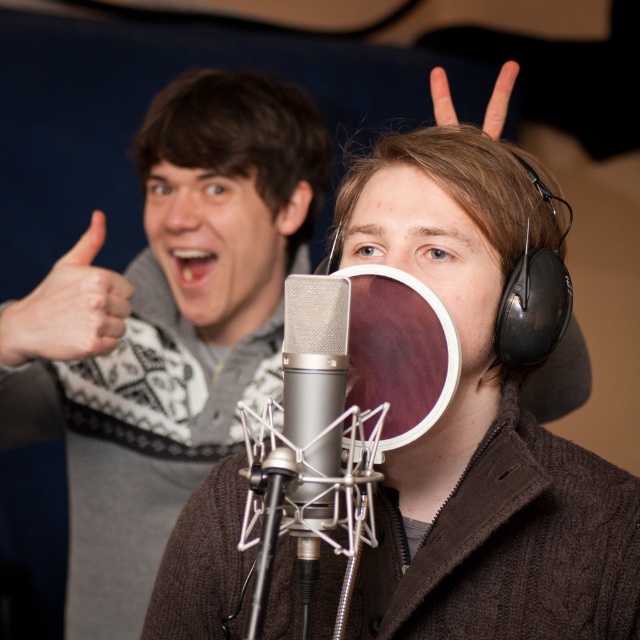
Who is positioned more to the right, skinny-fingered hand at upper left or white matte hand at upper center?

From the viewer's perspective, white matte hand at upper center appears more on the right side.

Locate an element on the screen. skinny-fingered hand at upper left is located at coordinates (68, 307).

Who is taller, silver metallic microphone at center or skinny-fingered hand at upper left?

Standing taller between the two is silver metallic microphone at center.

Measure the distance between silver metallic microphone at center and camera.

silver metallic microphone at center and camera are 30.16 inches apart.

Identify the location of silver metallic microphone at center. (316, 368).

Between silver metallic microphone at center and white matte hand at upper center, which one is positioned lower?

silver metallic microphone at center is below.

Between point (344, 296) and point (433, 99), which one is positioned behind?

The point (433, 99) is more distant.

Who is more forward, [320,310] or [436,116]?

Point [320,310] is more forward.

This screenshot has height=640, width=640. Identify the location of silver metallic microphone at center. (316, 368).